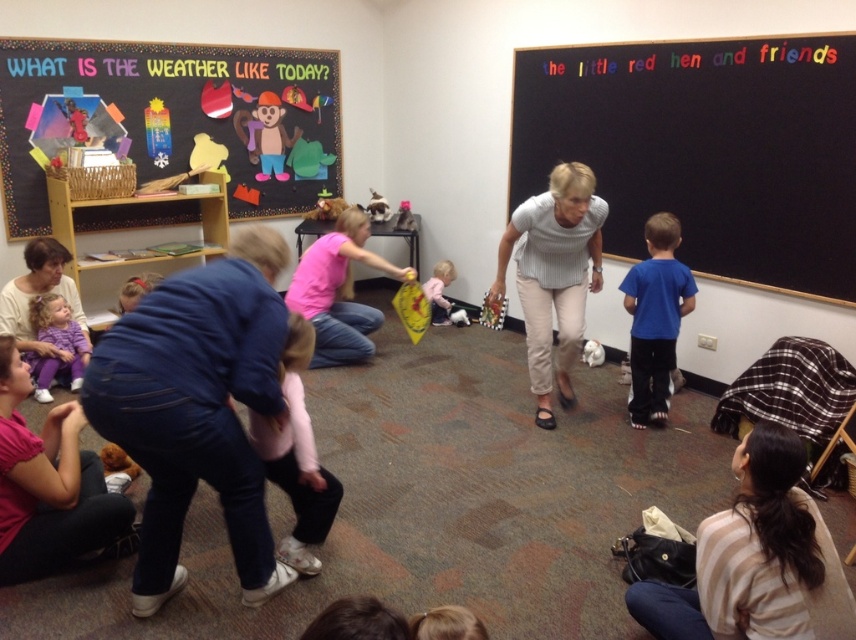
Is multicolored paper cutouts at upper left positioned behind pink fabric shirt at lower left?

Yes, it is behind pink fabric shirt at lower left.

Can you confirm if multicolored paper cutouts at upper left is positioned to the right of pink fabric shirt at lower left?

Incorrect, multicolored paper cutouts at upper left is not on the right side of pink fabric shirt at lower left.

Is point (339, 138) more distant than point (100, 477)?

That is True.

Find the location of a particular element. The width and height of the screenshot is (856, 640). multicolored paper cutouts at upper left is located at coordinates (170, 118).

Can you confirm if gray striped shirt at center is thinner than light pink fabric dress at center?

A: No, gray striped shirt at center is not thinner than light pink fabric dress at center.

Between gray striped shirt at center and light pink fabric dress at center, which one appears on the right side from the viewer's perspective?

From the viewer's perspective, gray striped shirt at center appears more on the right side.

This screenshot has height=640, width=856. What are the coordinates of `gray striped shirt at center` in the screenshot? It's located at (553, 275).

Does pink fleece jacket at center have a larger size compared to light pink fabric dress at center?

Yes.

Between point (281, 358) and point (443, 272), which one is positioned in front?

Point (281, 358) is in front.

Where is `pink fleece jacket at center`? The height and width of the screenshot is (640, 856). pink fleece jacket at center is located at coordinates (296, 456).